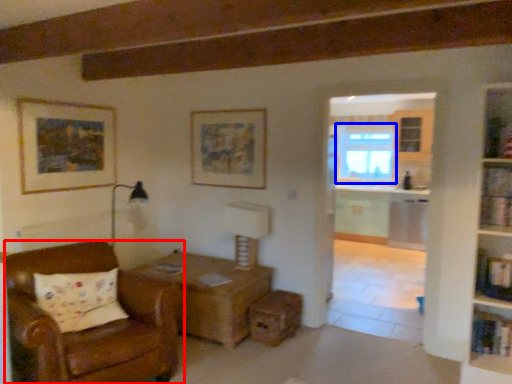
Question: Which object is further to the camera taking this photo, chair (highlighted by a red box) or window (highlighted by a blue box)?

Choices:
 (A) chair
 (B) window

Answer: (B)